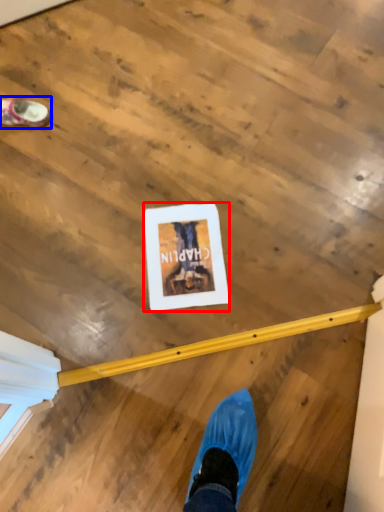
Question: Among these objects, which one is nearest to the camera, postcard (highlighted by a red box) or footwear (highlighted by a blue box)?

Choices:
 (A) postcard
 (B) footwear

Answer: (A)